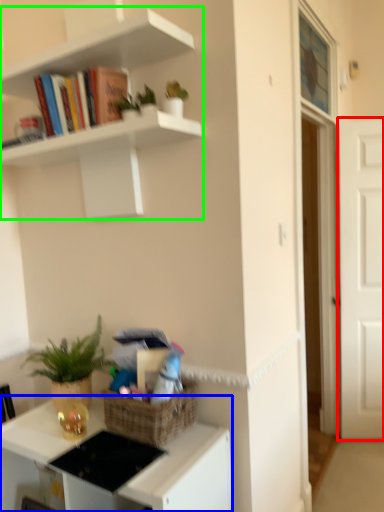
Question: Which object is the farthest from door (highlighted by a red box)? Choose among these: desk (highlighted by a blue box) or shelf (highlighted by a green box).

Choices:
 (A) desk
 (B) shelf

Answer: (A)